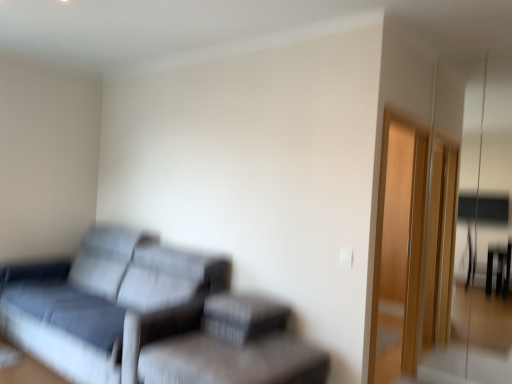
Question: From a real-world perspective, is textured gray couch at left physically above textured fabric footrest at lower center?

Choices:
 (A) no
 (B) yes

Answer: (A)

Question: Does textured gray couch at left have a lesser width compared to textured fabric footrest at lower center?

Choices:
 (A) no
 (B) yes

Answer: (A)

Question: Is the surface of textured gray couch at left in direct contact with textured fabric footrest at lower center?

Choices:
 (A) yes
 (B) no

Answer: (B)

Question: Does textured gray couch at left come in front of textured fabric footrest at lower center?

Choices:
 (A) no
 (B) yes

Answer: (B)

Question: From the image's perspective, is textured gray couch at left above textured fabric footrest at lower center?

Choices:
 (A) yes
 (B) no

Answer: (A)

Question: Which is correct: textured fabric footrest at lower center is inside textured gray couch at left, or outside of it?

Choices:
 (A) outside
 (B) inside

Answer: (A)

Question: In the image, is textured fabric footrest at lower center on the left side or the right side of textured gray couch at left?

Choices:
 (A) left
 (B) right

Answer: (B)

Question: From a real-world perspective, relative to textured gray couch at left, is textured fabric footrest at lower center vertically above or below?

Choices:
 (A) below
 (B) above

Answer: (B)

Question: Considering the positions of textured fabric footrest at lower center and textured gray couch at left in the image, is textured fabric footrest at lower center wider or thinner than textured gray couch at left?

Choices:
 (A) wide
 (B) thin

Answer: (B)

Question: Considering their positions, is textured gray couch at left located in front of or behind textured gray swivel chair at lower center?

Choices:
 (A) behind
 (B) front

Answer: (A)

Question: Considering the relative positions of textured gray couch at left and textured gray swivel chair at lower center in the image provided, is textured gray couch at left to the left or to the right of textured gray swivel chair at lower center?

Choices:
 (A) left
 (B) right

Answer: (A)

Question: Is textured gray couch at left inside the boundaries of textured gray swivel chair at lower center, or outside?

Choices:
 (A) inside
 (B) outside

Answer: (B)

Question: Considering the positions of textured gray couch at left and textured gray swivel chair at lower center in the image, is textured gray couch at left wider or thinner than textured gray swivel chair at lower center?

Choices:
 (A) wide
 (B) thin

Answer: (A)

Question: Looking at the image, does textured gray couch at left seem bigger or smaller compared to transparent glass door at right?

Choices:
 (A) small
 (B) big

Answer: (B)

Question: Would you say textured gray couch at left is to the left or to the right of transparent glass door at right in the picture?

Choices:
 (A) right
 (B) left

Answer: (B)